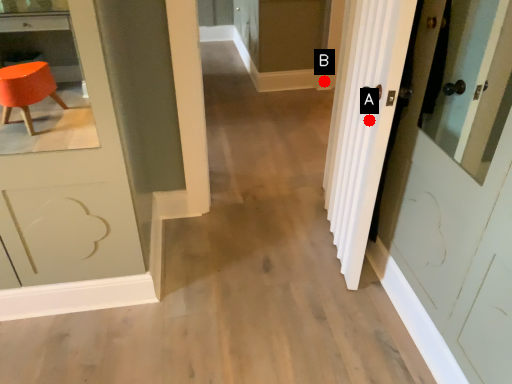
Question: Two points are circled on the image, labeled by A and B beside each circle. Which point is closer to the camera?

Choices:
 (A) A is closer
 (B) B is closer

Answer: (A)